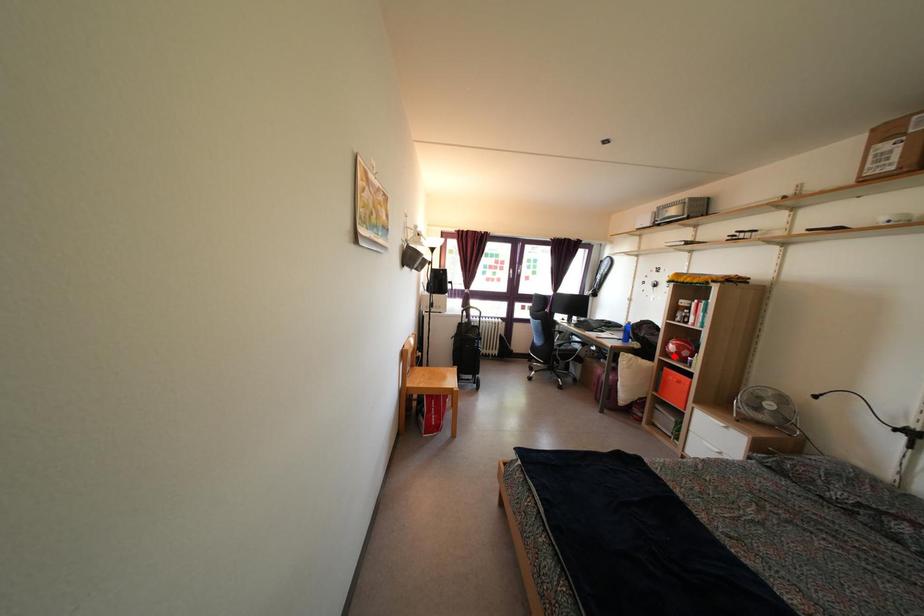
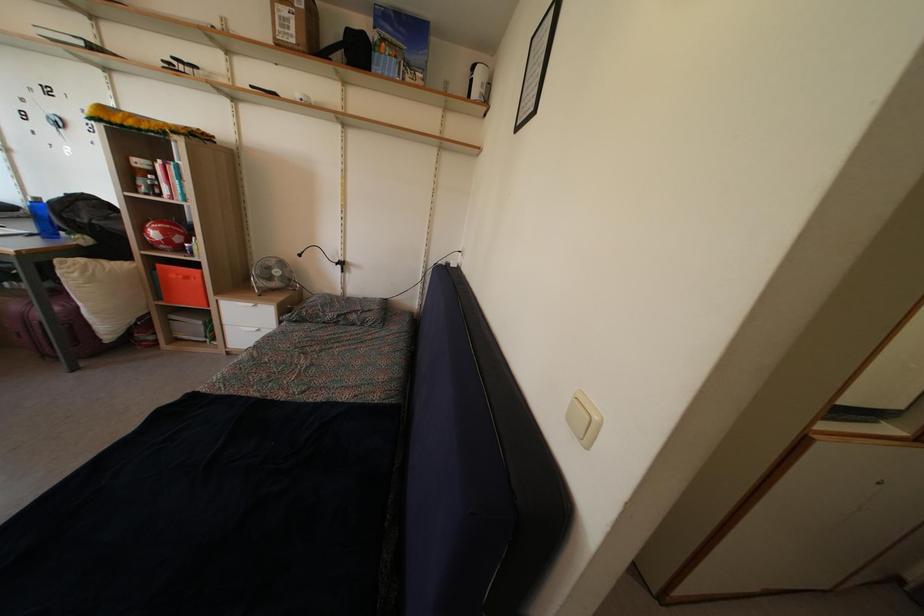
Question: I am providing you with two images of the same scene from different viewpoints. Given a red point in image1, look at the same physical point in image2. Is it:

Choices:
 (A) Closer to the viewpoint
 (B) Farther from the viewpoint

Answer: (B)